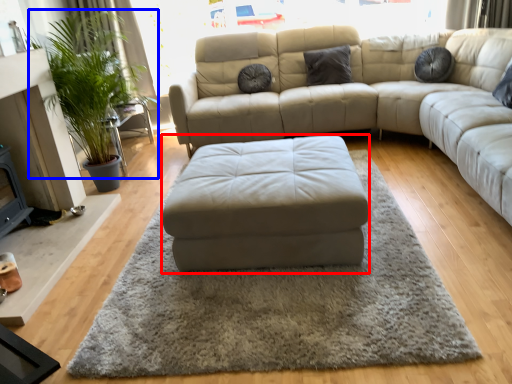
Question: Among these objects, which one is farthest to the camera, footrest (highlighted by a red box) or plant (highlighted by a blue box)?

Choices:
 (A) footrest
 (B) plant

Answer: (B)